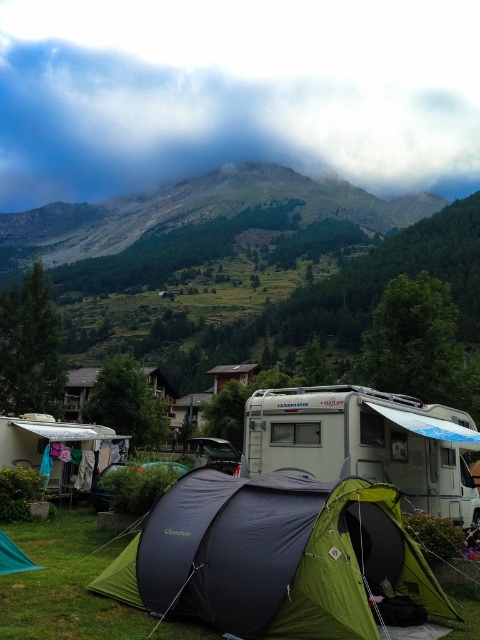
You are a hiker planning to set up a tent in the camping area shown. You notice the cloudy sky at upper center and the green fabric tent at center. Which object is positioned to the left of the other?

The cloudy sky at upper center is to the left of green fabric tent at center.

You are planning to set up a new tent in the camping area shown. The white plastic camper at center is already parked. Where should you place your tent to ensure it is not directly behind the camper? Please provide coordinates based on the image grid system where the bottom left corner is 0,0 and the top right is 1,1.

The white plastic camper at center is located at point (x=365, y=442). To avoid placing your tent directly behind it, choose coordinates with a y value lower than 0.762, ensuring the tent is in front of or to the side of the camper.